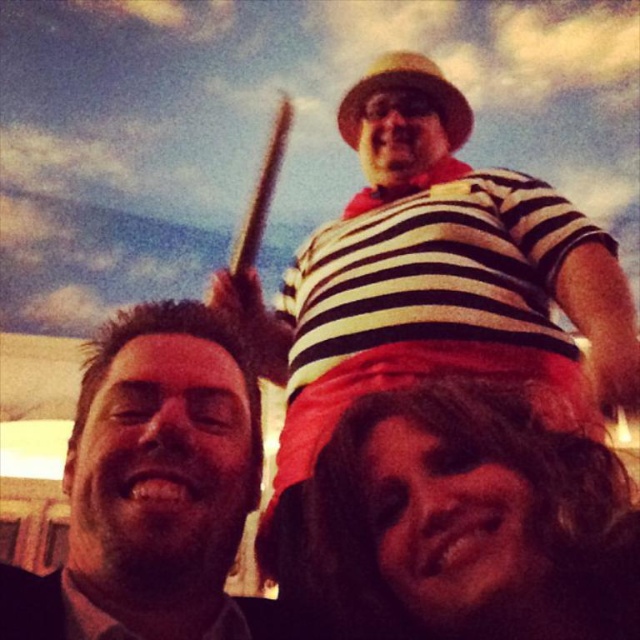
In the scene shown: Does striped cotton shirt at upper center have a greater width compared to dark brown hair at left?

Correct, the width of striped cotton shirt at upper center exceeds that of dark brown hair at left.

Which is more to the right, striped cotton shirt at upper center or dark brown hair at left?

From the viewer's perspective, striped cotton shirt at upper center appears more on the right side.

Who is more distant from viewer, (438,486) or (234,516)?

Point (234,516)

You are a GUI agent. You are given a task and a screenshot of the screen. Output one action in this format:
    pyautogui.click(x=<x>, y=<y>)
    Task: Click on the striped cotton shirt at upper center
    The width and height of the screenshot is (640, 640).
    Given the screenshot: What is the action you would take?
    pyautogui.click(x=448, y=394)

Between dark curly hair at lower center and dark brown hair at left, which one appears on the left side from the viewer's perspective?

Positioned to the left is dark brown hair at left.

Is point (593, 637) more distant than point (106, 552)?

No, it is in front of (106, 552).

At what (x,y) coordinates should I click in order to perform the action: click on dark curly hair at lower center. Please return your answer as a coordinate pair (x, y). The image size is (640, 640). Looking at the image, I should click on (470, 522).

Where is `striped cotton shirt at upper center`? Image resolution: width=640 pixels, height=640 pixels. striped cotton shirt at upper center is located at coordinates (448, 394).

Can you confirm if striped cotton shirt at upper center is wider than dark curly hair at lower center?

Correct, the width of striped cotton shirt at upper center exceeds that of dark curly hair at lower center.

This screenshot has width=640, height=640. Find the location of `striped cotton shirt at upper center`. striped cotton shirt at upper center is located at coordinates click(x=448, y=394).